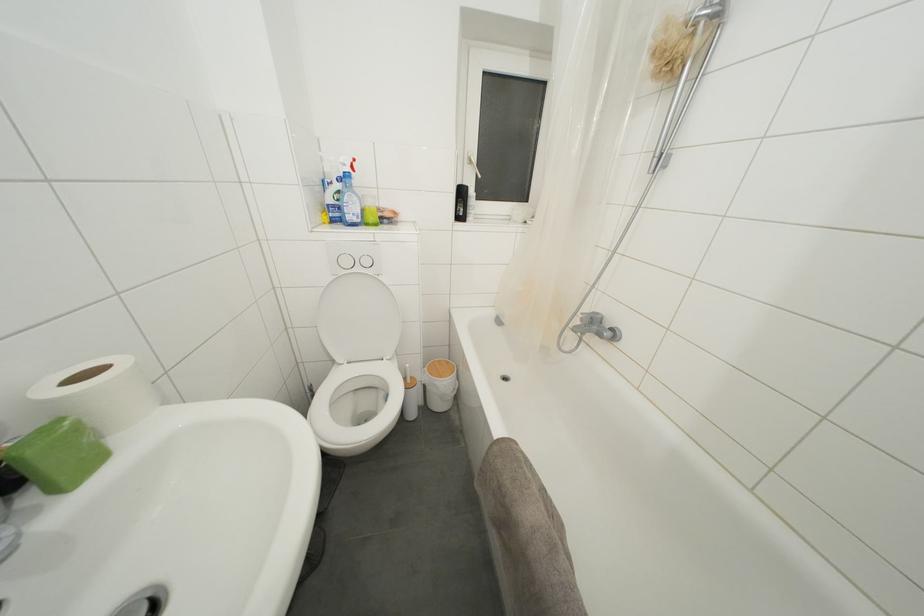
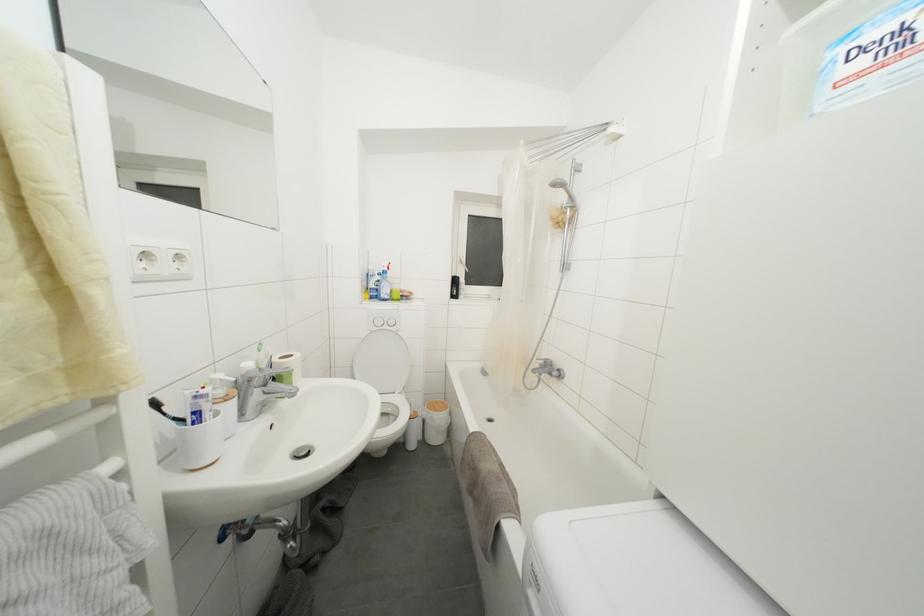
Locate, in the second image, the point that corresponds to (507,444) in the first image.

(480, 438)